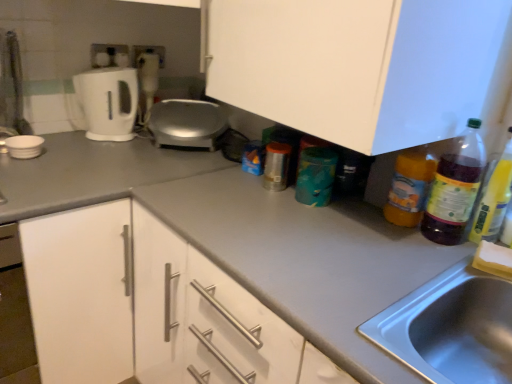
This screenshot has height=384, width=512. Identify the location of vacant space in between white plastic blender at upper left and white matte bowl at left, which is the second appliance from right to left. (84, 140).